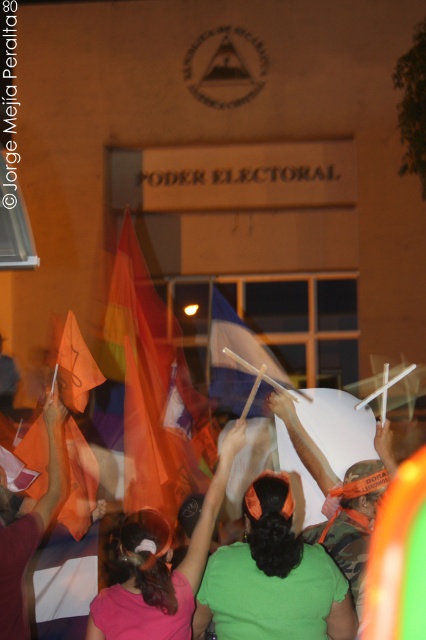
Question: Which object appears farthest from the camera in this image?

Choices:
 (A) green fabric headband at center
 (B) pink fabric headband at upper center
 (C) blue fabric flag at center
 (D) pink fabric at center

Answer: (C)

Question: Can you confirm if green fabric headband at center is positioned to the left of blue fabric flag at center?

Choices:
 (A) no
 (B) yes

Answer: (A)

Question: Can you confirm if blue fabric flag at center is positioned above orange fabric flag at center?

Choices:
 (A) yes
 (B) no

Answer: (B)

Question: Which of these objects is positioned farthest from the pink fabric headband at upper center?

Choices:
 (A) translucent fabric flag at center
 (B) blue fabric flag at center

Answer: (B)

Question: Considering the real-world distances, which object is closest to the pink fabric headband at upper center?

Choices:
 (A) translucent fabric flag at center
 (B) pink fabric at center

Answer: (B)

Question: Does translucent fabric flag at center appear on the right side of pink fabric headband at upper center?

Choices:
 (A) no
 (B) yes

Answer: (B)